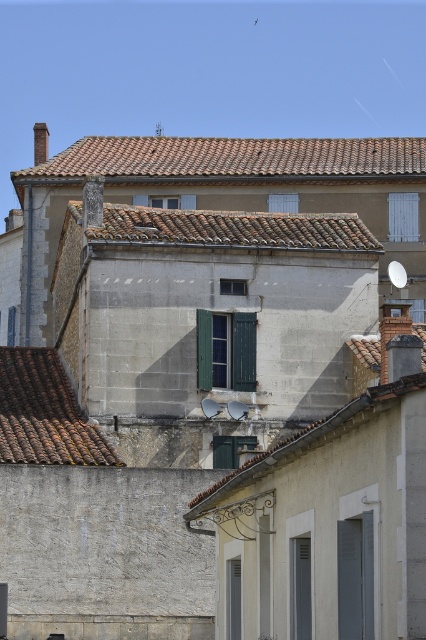
You are standing in the residential area and want to locate the brown tile roof at lower left. According to the coordinates, where exactly is it positioned?

The brown tile roof at lower left is located at the 2D coordinates point [45,413].

You are standing in front of the two story building and need to locate the brown tile roof at lower left and the green matte shutter at center. From your perspective, which object is positioned to the left?

The brown tile roof at lower left is positioned to the left of the green matte shutter at center.